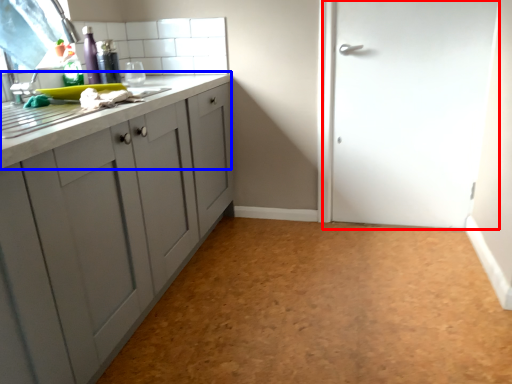
Question: Which object appears closest to the camera in this image, door (highlighted by a red box) or countertop (highlighted by a blue box)?

Choices:
 (A) door
 (B) countertop

Answer: (B)